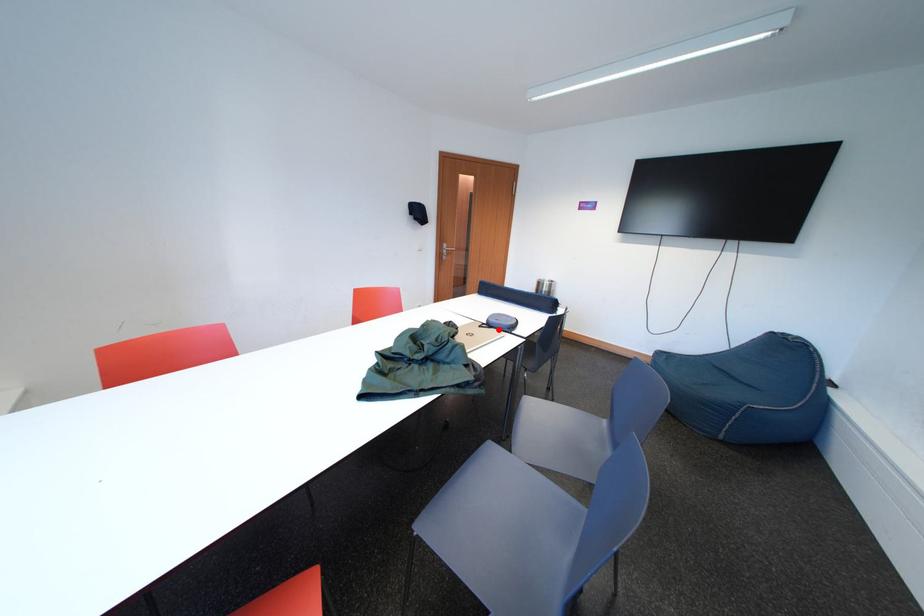
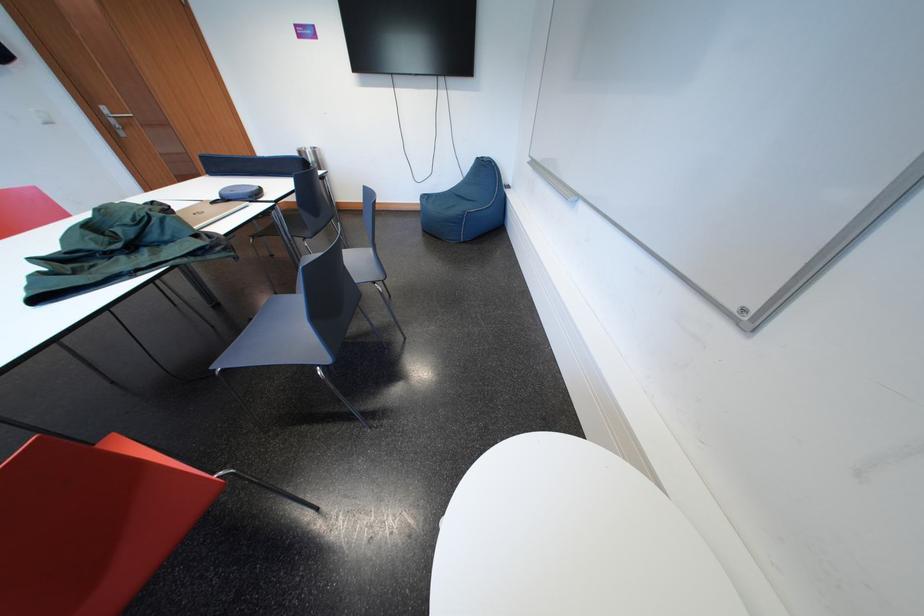
In the second image, find the point that corresponds to the highlighted location in the first image.

(235, 204)